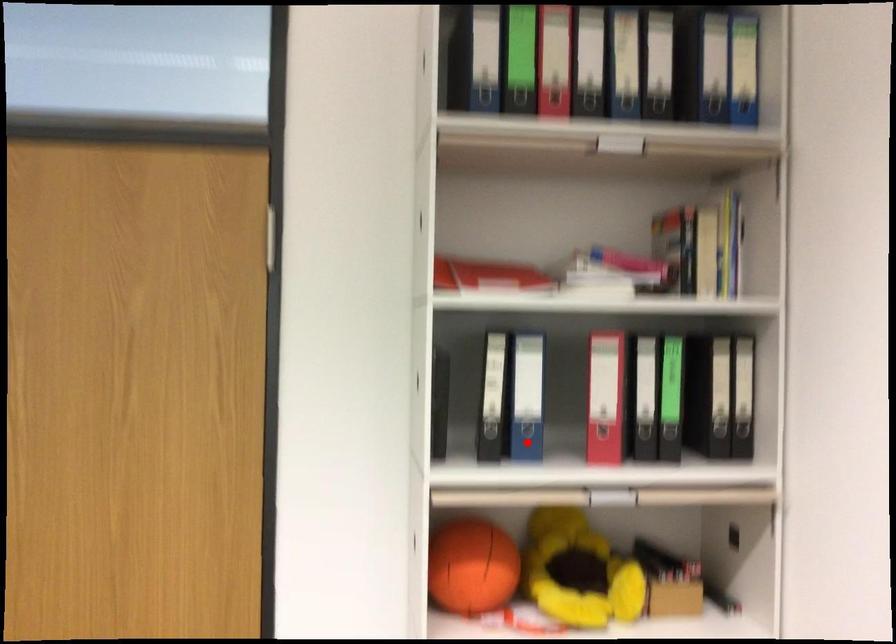
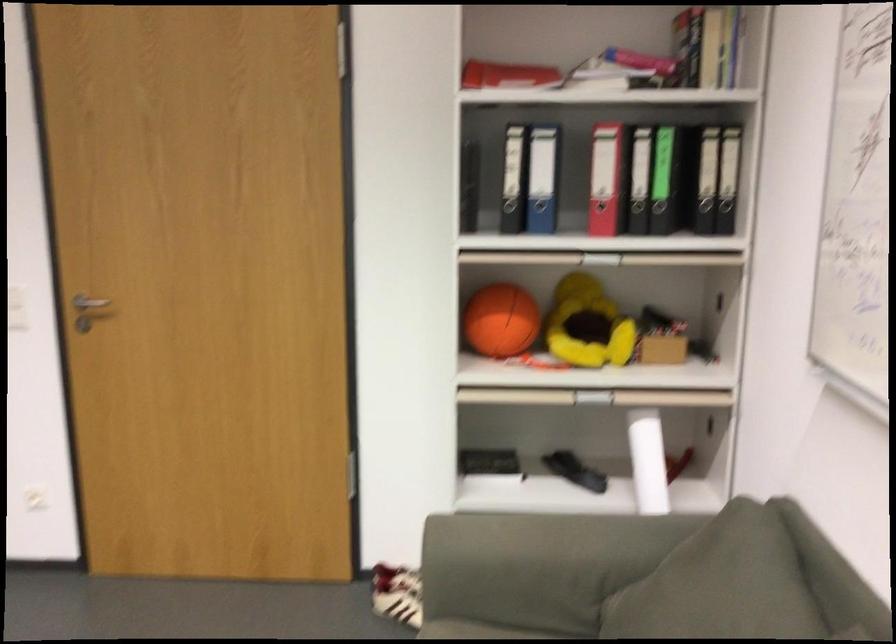
Question: I am providing you with two images of the same scene from different viewpoints. Given a red point in image1, look at the same physical point in image2. Is it:

Choices:
 (A) Closer to the viewpoint
 (B) Farther from the viewpoint

Answer: (B)